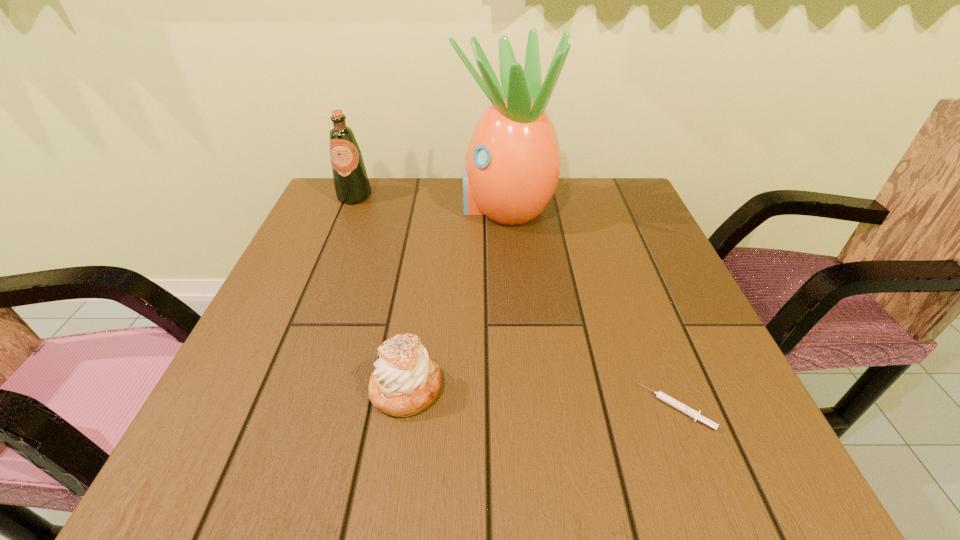
Locate an element on the screen. The image size is (960, 540). object that is positioned at the near right corner is located at coordinates (694, 414).

The width and height of the screenshot is (960, 540). In the image, there is a desktop. Find the location of `vacant area at the far edge`. vacant area at the far edge is located at coordinates (562, 183).

You are a GUI agent. You are given a task and a screenshot of the screen. Output one action in this format:
    pyautogui.click(x=<x>, y=<y>)
    Task: Click on the free space at the left edge of the desktop
    The height and width of the screenshot is (540, 960).
    Given the screenshot: What is the action you would take?
    pyautogui.click(x=242, y=389)

I want to click on vacant space at the right edge of the desktop, so click(x=605, y=234).

Find the location of `vacant region at the far left corner of the desktop`. vacant region at the far left corner of the desktop is located at coordinates (324, 189).

In order to click on vacant space at the near left corner in this screenshot , I will do `click(243, 478)`.

Where is `free space between the pineapple and the third tallest object`? The height and width of the screenshot is (540, 960). free space between the pineapple and the third tallest object is located at coordinates (456, 298).

Where is `free space between the leftmost object and the pineapple`? This screenshot has width=960, height=540. free space between the leftmost object and the pineapple is located at coordinates (430, 201).

Where is `free space between the shortest object and the tallest object`? free space between the shortest object and the tallest object is located at coordinates (590, 307).

Find the location of a particular element. The width and height of the screenshot is (960, 540). free space between the third shortest object and the pastry is located at coordinates (380, 292).